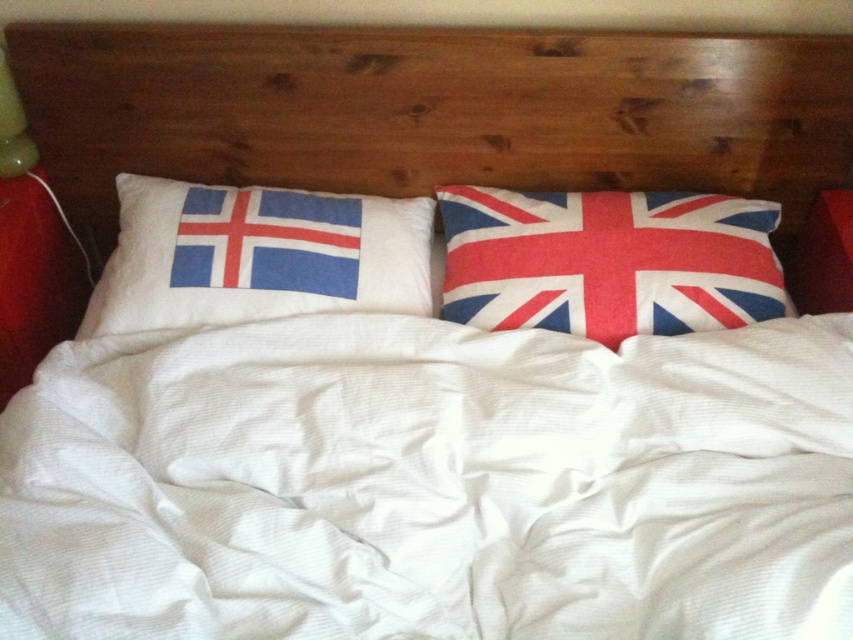
Does white textured sheet at center lie in front of textured cotton pillow with union jack design at right?

Yes, white textured sheet at center is closer to the viewer.

Does point (287, 404) lie in front of point (637, 252)?

That is True.

Locate an element on the screen. This screenshot has height=640, width=853. white textured sheet at center is located at coordinates (431, 484).

Who is positioned more to the left, white textured sheet at center or wooden headboard at center?

Positioned to the left is white textured sheet at center.

Who is positioned more to the right, white textured sheet at center or wooden headboard at center?

wooden headboard at center is more to the right.

Is point (21, 628) farther from viewer compared to point (70, 109)?

That is False.

Locate an element on the screen. This screenshot has height=640, width=853. white textured sheet at center is located at coordinates (431, 484).

Who is lower down, wooden headboard at center or white cotton pillow with flag design at left?

white cotton pillow with flag design at left is below.

Which is behind, point (706, 122) or point (225, 269)?

The point (706, 122) is behind.

Does point (109, 186) come closer to viewer compared to point (338, 202)?

No, (109, 186) is behind (338, 202).

Where is `wooden headboard at center`? The height and width of the screenshot is (640, 853). wooden headboard at center is located at coordinates (433, 109).